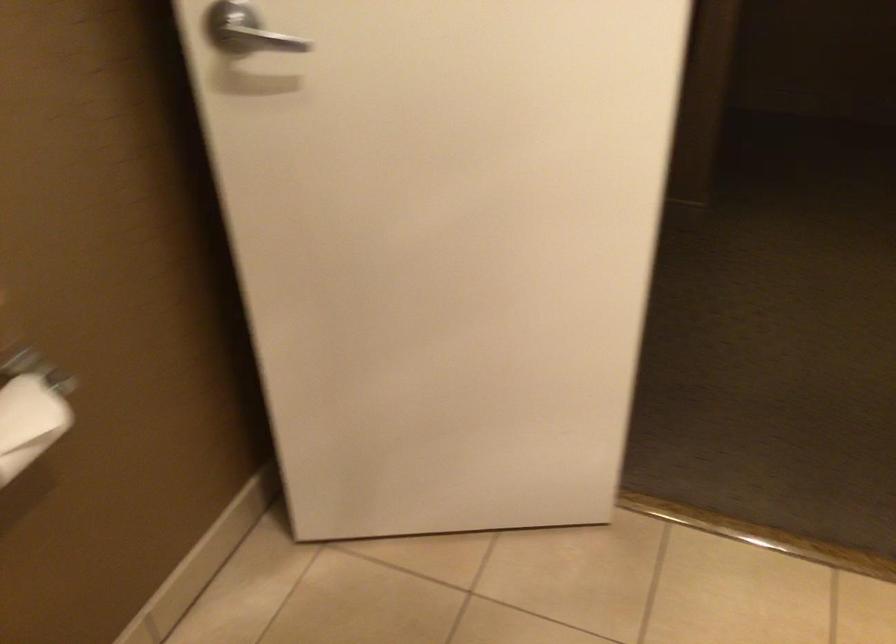
At what (x,y) coordinates should I click in order to perform the action: click on silver door handle. Please return your answer as a coordinate pair (x, y). The image size is (896, 644). Looking at the image, I should click on (257, 39).